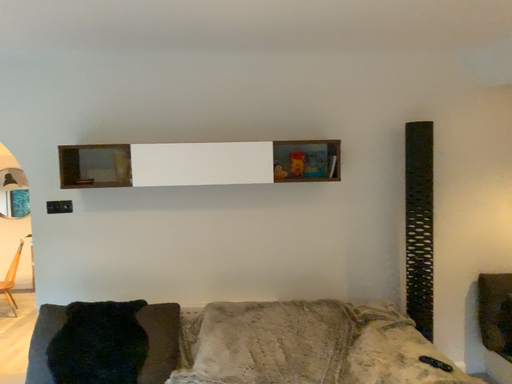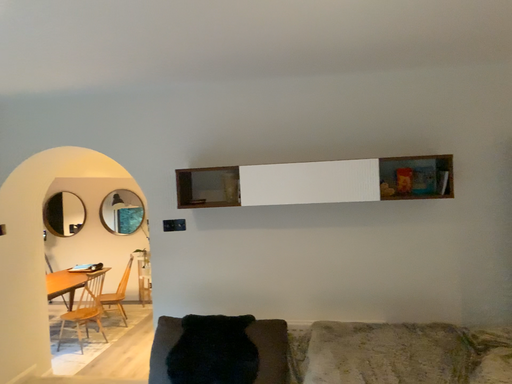
Question: Which way did the camera rotate in the video?

Choices:
 (A) rotated left
 (B) rotated right

Answer: (A)